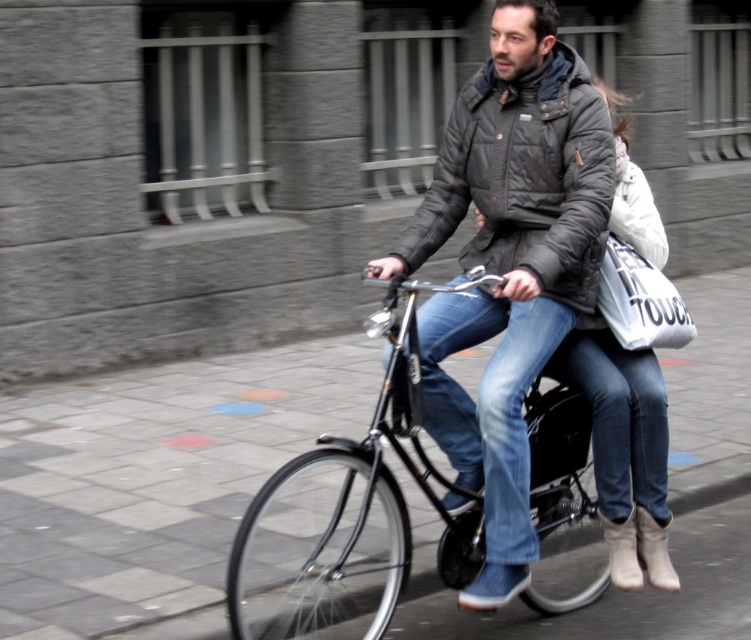
You are a delivery person who needs to attach a GPS tracker to the black matte bicycle at center. The GPS tracker has a diameter of 5 cm. The point you need to attach it to is located at coordinates point [348,515]. Is this point on the black matte bicycle at center?

Yes, the point [348,515] is on the black matte bicycle at center, so you can attach the GPS tracker there.

You are a delivery person who needs to place a small package between the matte black jacket at center and the white fabric bag at center. Based on their sizes, which object should you place the package closer to?

The matte black jacket at center might be wider than the white fabric bag at center, so placing the package closer to the white fabric bag at center would leave more space on the matte black jacket at center side.

You are a pedestrian standing on the sidewalk observing the bicycle riders. Which object, the matte black jacket at center or the white fabric bag at center, is positioned closer to the left side of the bicycle?

The matte black jacket at center is positioned to the left of the white fabric bag at center, so the matte black jacket at center is closer to the left side of the bicycle.